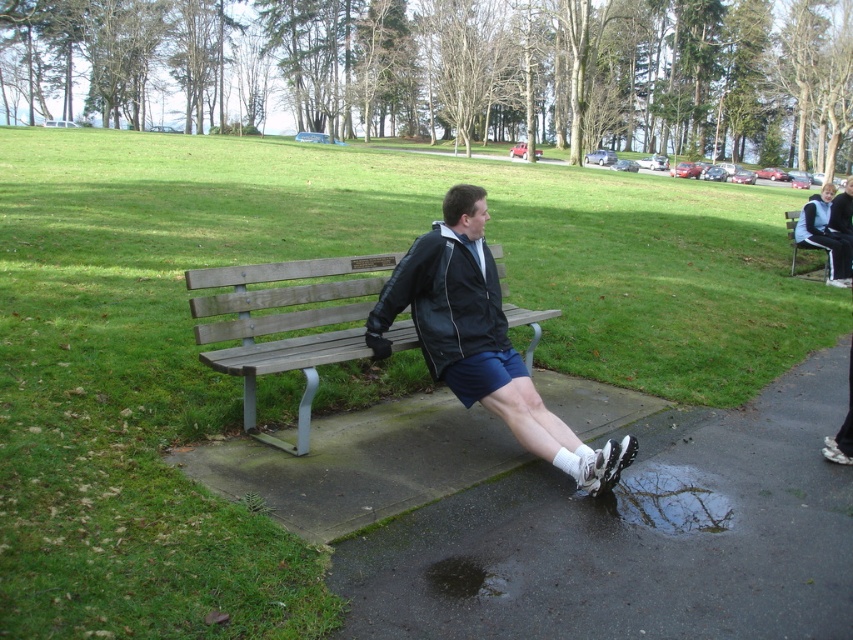
Is black leather jacket at center in front of wooden bench at center?

Yes, it is in front of wooden bench at center.

Looking at this image, which is above, black leather jacket at center or wooden bench at center?

Positioned higher is wooden bench at center.

What do you see at coordinates (480, 339) in the screenshot?
I see `black leather jacket at center` at bounding box center [480, 339].

The image size is (853, 640). Identify the location of black leather jacket at center. (480, 339).

Does wooden bench at center lie in front of wooden bench at right?

Yes, wooden bench at center is in front of wooden bench at right.

Based on the photo, who is taller, wooden bench at center or wooden bench at right?

wooden bench at center is taller.

At what (x,y) coordinates should I click in order to perform the action: click on wooden bench at center. Please return your answer as a coordinate pair (x, y). This screenshot has width=853, height=640. Looking at the image, I should click on (283, 324).

Can you confirm if black leather jacket at upper right is taller than wooden bench at right?

Yes, black leather jacket at upper right is taller than wooden bench at right.

Who is higher up, black leather jacket at upper right or wooden bench at right?

black leather jacket at upper right

Between point (821, 204) and point (792, 262), which one is positioned in front?

Positioned in front is point (821, 204).

Identify the location of black leather jacket at upper right. (824, 236).